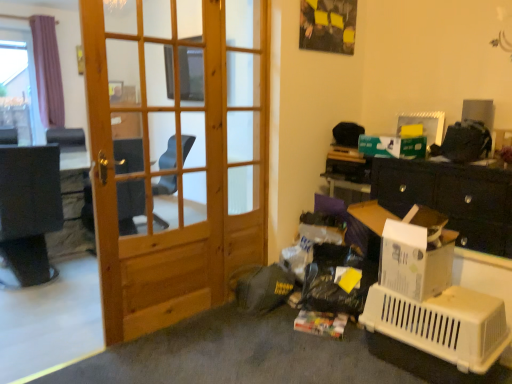
Question: From a real-world perspective, is natural wood door at center located beneath white plastic pet carrier at lower right?

Choices:
 (A) yes
 (B) no

Answer: (B)

Question: Does natural wood door at center have a lesser height compared to white plastic pet carrier at lower right?

Choices:
 (A) no
 (B) yes

Answer: (A)

Question: Can you confirm if natural wood door at center is taller than white plastic pet carrier at lower right?

Choices:
 (A) yes
 (B) no

Answer: (A)

Question: Considering the relative sizes of natural wood door at center and white plastic pet carrier at lower right in the image provided, is natural wood door at center thinner than white plastic pet carrier at lower right?

Choices:
 (A) yes
 (B) no

Answer: (A)

Question: Is natural wood door at center positioned behind white plastic pet carrier at lower right?

Choices:
 (A) no
 (B) yes

Answer: (B)

Question: Relative to natural wood door at center, is wooden screen door at center in front or behind?

Choices:
 (A) front
 (B) behind

Answer: (B)

Question: From the image's perspective, is wooden screen door at center positioned above or below natural wood door at center?

Choices:
 (A) above
 (B) below

Answer: (A)

Question: Is point (245, 139) positioned closer to the camera than point (114, 276)?

Choices:
 (A) closer
 (B) farther

Answer: (B)

Question: Based on their positions, is wooden screen door at center located to the left or right of natural wood door at center?

Choices:
 (A) left
 (B) right

Answer: (B)

Question: From the image's perspective, is natural wood door at center located above or below white plastic pet carrier at lower right?

Choices:
 (A) below
 (B) above

Answer: (B)

Question: Is natural wood door at center bigger or smaller than white plastic pet carrier at lower right?

Choices:
 (A) small
 (B) big

Answer: (B)

Question: In terms of height, does natural wood door at center look taller or shorter compared to white plastic pet carrier at lower right?

Choices:
 (A) short
 (B) tall

Answer: (B)

Question: Relative to white plastic pet carrier at lower right, is natural wood door at center in front or behind?

Choices:
 (A) behind
 (B) front

Answer: (A)

Question: Is white plastic pet carrier at lower right situated inside wooden screen door at center or outside?

Choices:
 (A) inside
 (B) outside

Answer: (B)

Question: Visually, is white plastic pet carrier at lower right positioned to the left or to the right of wooden screen door at center?

Choices:
 (A) left
 (B) right

Answer: (B)